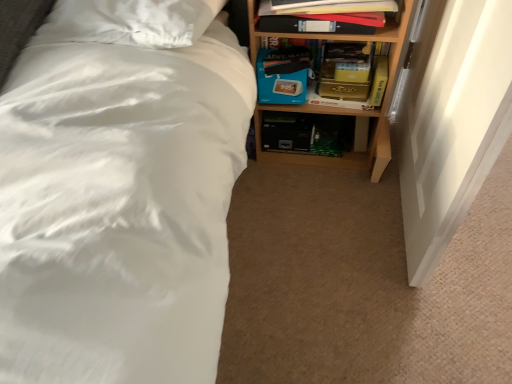
Question: Should I look upward or downward to see wooden bookshelf at upper right?

Choices:
 (A) up
 (B) down

Answer: (A)

Question: Is blue cardboard box at center bigger than matte black book at upper right, which is the first book from back to front?

Choices:
 (A) yes
 (B) no

Answer: (B)

Question: From a real-world perspective, is blue cardboard box at center positioned under matte black book at upper right, which is the first book from back to front, based on gravity?

Choices:
 (A) yes
 (B) no

Answer: (A)

Question: Is blue cardboard box at center touching matte black book at upper right, which is the first book from back to front?

Choices:
 (A) yes
 (B) no

Answer: (A)

Question: From a real-world perspective, is blue cardboard box at center positioned over matte black book at upper right, the 2th book viewed from the front, based on gravity?

Choices:
 (A) yes
 (B) no

Answer: (B)

Question: Does blue cardboard box at center lie behind matte black book at upper right, the 2th book viewed from the front?

Choices:
 (A) yes
 (B) no

Answer: (A)

Question: Is blue cardboard box at center surrounding matte black book at upper right, the 2th book viewed from the front?

Choices:
 (A) no
 (B) yes

Answer: (A)

Question: Considering the relative positions of wooden bookshelf at upper right and matte black book at upper right, marked as the first book in a front-to-back arrangement, in the image provided, is wooden bookshelf at upper right in front of matte black book at upper right, marked as the first book in a front-to-back arrangement,?

Choices:
 (A) no
 (B) yes

Answer: (A)

Question: Can you confirm if wooden bookshelf at upper right is shorter than matte black book at upper right, positioned as the second book in back-to-front order?

Choices:
 (A) yes
 (B) no

Answer: (B)

Question: Is wooden bookshelf at upper right next to matte black book at upper right, positioned as the second book in back-to-front order?

Choices:
 (A) yes
 (B) no

Answer: (B)

Question: Is wooden bookshelf at upper right further to the viewer compared to matte black book at upper right, positioned as the second book in back-to-front order?

Choices:
 (A) yes
 (B) no

Answer: (A)

Question: Can matte black book at upper right, positioned as the second book in back-to-front order, be found inside wooden bookshelf at upper right?

Choices:
 (A) no
 (B) yes

Answer: (B)

Question: Is wooden bookshelf at upper right not inside matte black book at upper right, marked as the first book in a front-to-back arrangement?

Choices:
 (A) yes
 (B) no

Answer: (A)

Question: From a real-world perspective, is matte black book at upper right, the 2th book viewed from the front, on wooden bookshelf at upper right?

Choices:
 (A) yes
 (B) no

Answer: (A)